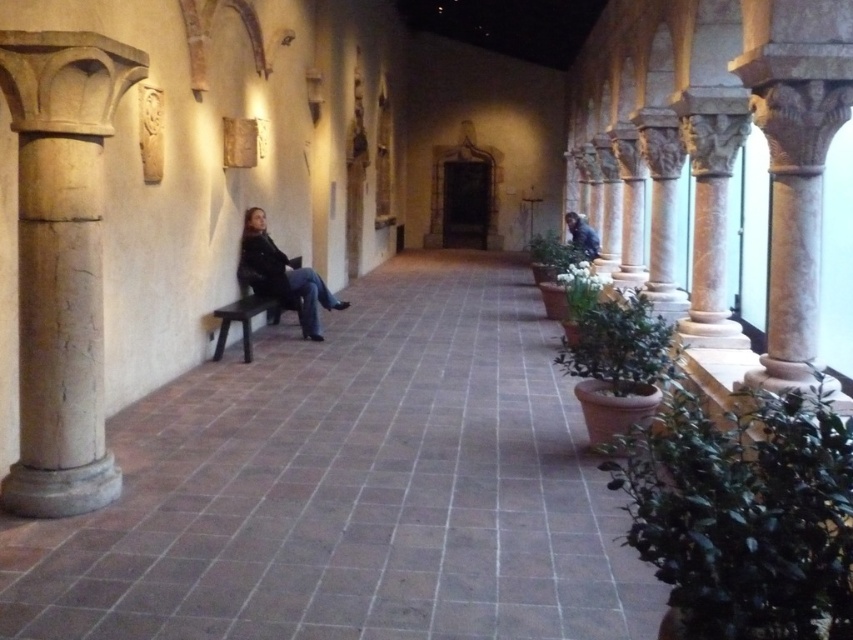
Question: Which of these objects is positioned closest to the blue denim jacket at center?

Choices:
 (A) dark blue jeans at center
 (B) dark brown wooden bench at left
 (C) brown stone bench at left
 (D) light beige stone column at left

Answer: (A)

Question: Does light beige stone column at left appear over dark brown wooden bench at left?

Choices:
 (A) no
 (B) yes

Answer: (B)

Question: Among these points, which one is farthest from the camera?

Choices:
 (A) (252, 221)
 (B) (581, 234)

Answer: (B)

Question: Is light beige stone column at left to the right of dark brown wooden bench at left from the viewer's perspective?

Choices:
 (A) yes
 (B) no

Answer: (A)

Question: Which point is farther from the camera taking this photo?

Choices:
 (A) (219, 312)
 (B) (36, 342)
 (C) (593, 236)
 (D) (276, 244)

Answer: (C)

Question: Does brown stone bench at left appear under blue denim jacket at center?

Choices:
 (A) yes
 (B) no

Answer: (A)